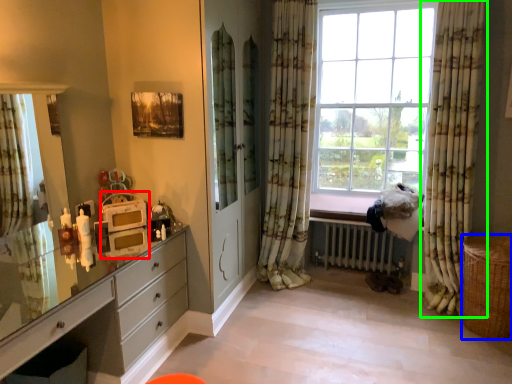
Question: Based on their relative distances, which object is farther from appliance (highlighted by a red box)? Choose from basket (highlighted by a blue box) and curtain (highlighted by a green box).

Choices:
 (A) basket
 (B) curtain

Answer: (A)